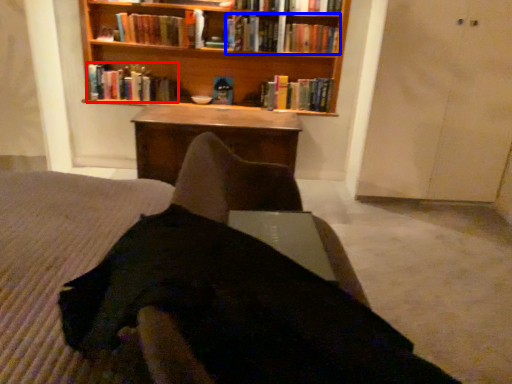
Question: Which point is closer to the camera, book (highlighted by a red box) or book (highlighted by a blue box)?

Choices:
 (A) book
 (B) book

Answer: (B)